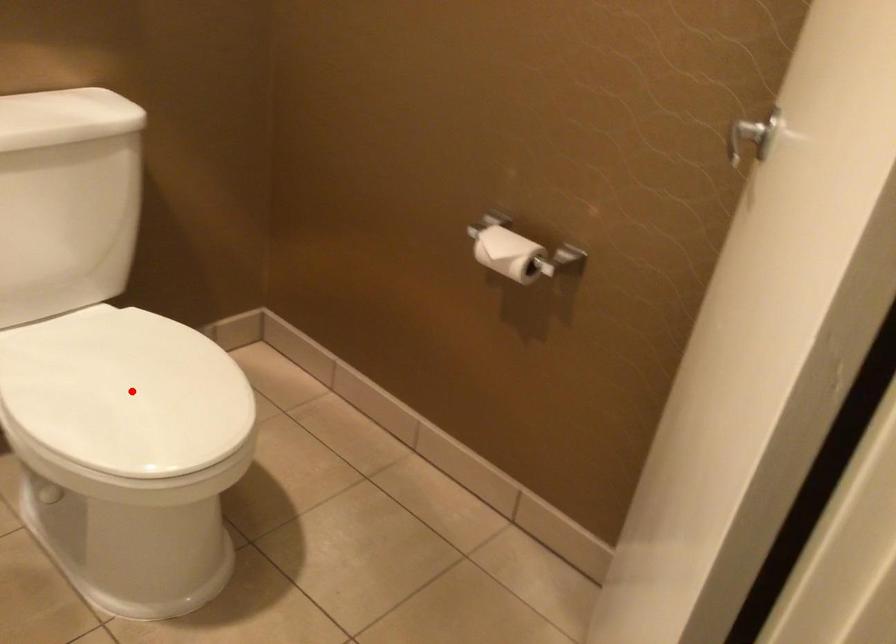
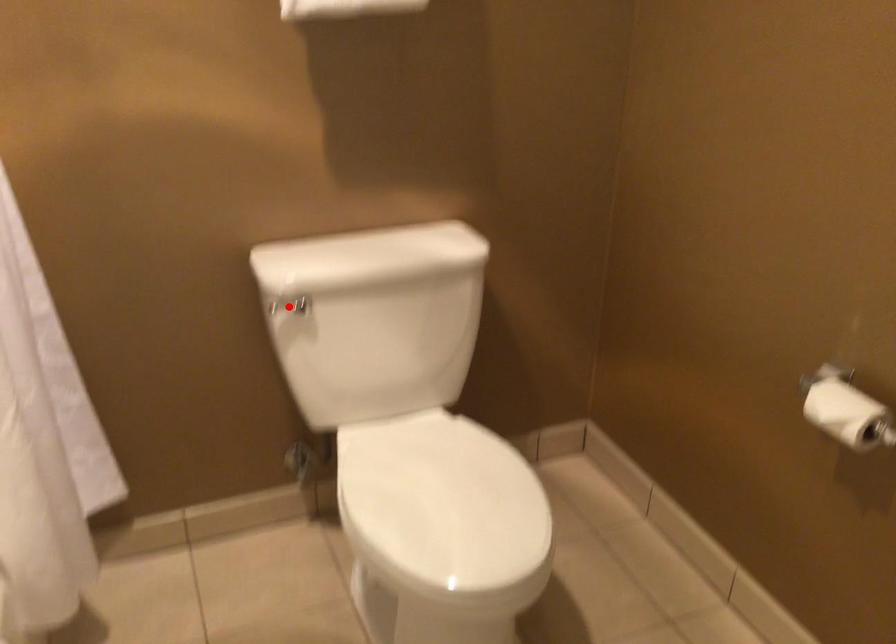
I am providing you with two images of the same scene from different viewpoints. A red point is marked on the first image and another point is marked on the second image. Does the point marked in image1 correspond to the same location as the one in image2?

No